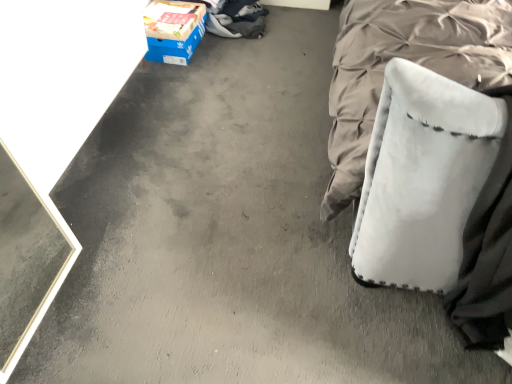
The height and width of the screenshot is (384, 512). Identify the location of white fabric swivel chair at right. (423, 178).

The image size is (512, 384). What do you see at coordinates (423, 178) in the screenshot? I see `white fabric swivel chair at right` at bounding box center [423, 178].

This screenshot has width=512, height=384. Describe the element at coordinates (173, 30) in the screenshot. I see `blue cardboard box at upper left` at that location.

Identify the location of blue cardboard box at upper left. The height and width of the screenshot is (384, 512). (173, 30).

Find the location of a particular element. white fabric swivel chair at right is located at coordinates (423, 178).

Which object is positioned more to the left, blue cardboard box at upper left or white fabric swivel chair at right?

Positioned to the left is blue cardboard box at upper left.

Which is behind, blue cardboard box at upper left or white fabric swivel chair at right?

Positioned behind is blue cardboard box at upper left.

Does point (162, 37) lie in front of point (372, 219)?

No, (162, 37) is further to viewer.

From the image's perspective, relative to white fabric swivel chair at right, is blue cardboard box at upper left above or below?

Based on their image positions, blue cardboard box at upper left is located above white fabric swivel chair at right.

From a real-world perspective, which object stands above the other?

From a 3D spatial view, white fabric swivel chair at right is above.

Considering the relative sizes of blue cardboard box at upper left and white fabric swivel chair at right in the image provided, is blue cardboard box at upper left wider than white fabric swivel chair at right?

No, blue cardboard box at upper left is not wider than white fabric swivel chair at right.

Is blue cardboard box at upper left shorter than white fabric swivel chair at right?

Correct, blue cardboard box at upper left is not as tall as white fabric swivel chair at right.

Can you confirm if blue cardboard box at upper left is bigger than white fabric swivel chair at right?

No.

Could white fabric swivel chair at right be considered to be inside blue cardboard box at upper left?

No, white fabric swivel chair at right is located outside of blue cardboard box at upper left.

Are blue cardboard box at upper left and white fabric swivel chair at right making contact?

No.

Could you tell me if blue cardboard box at upper left is turned towards white fabric swivel chair at right?

No.

What's the angular difference between blue cardboard box at upper left and white fabric swivel chair at right's facing directions?

The facing directions of blue cardboard box at upper left and white fabric swivel chair at right are 89.9 degrees apart.

Measure the distance from blue cardboard box at upper left to white fabric swivel chair at right.

The distance of blue cardboard box at upper left from white fabric swivel chair at right is 4.45 feet.

What are the coordinates of `box located underneath the white fabric swivel chair at right (from a real-world perspective)` in the screenshot? It's located at click(x=173, y=30).

Does white fabric swivel chair at right appear on the right side of blue cardboard box at upper left?

Correct, you'll find white fabric swivel chair at right to the right of blue cardboard box at upper left.

In the image, is white fabric swivel chair at right positioned in front of or behind blue cardboard box at upper left?

Visually, white fabric swivel chair at right is located in front of blue cardboard box at upper left.

Considering the points (449, 208) and (148, 36), which point is behind, point (449, 208) or point (148, 36)?

The point (148, 36) is more distant.

From the image's perspective, is white fabric swivel chair at right above or below blue cardboard box at upper left?

From the image's perspective, white fabric swivel chair at right appears below blue cardboard box at upper left.

From a real-world perspective, which is physically above, white fabric swivel chair at right or blue cardboard box at upper left?

white fabric swivel chair at right.

Is white fabric swivel chair at right wider or thinner than blue cardboard box at upper left?

Considering their sizes, white fabric swivel chair at right looks broader than blue cardboard box at upper left.

Who is shorter, white fabric swivel chair at right or blue cardboard box at upper left?

With less height is blue cardboard box at upper left.

Considering the sizes of objects white fabric swivel chair at right and blue cardboard box at upper left in the image provided, who is bigger, white fabric swivel chair at right or blue cardboard box at upper left?

With larger size is white fabric swivel chair at right.

Which is correct: white fabric swivel chair at right is inside blue cardboard box at upper left, or outside of it?

white fabric swivel chair at right is not enclosed by blue cardboard box at upper left.

Does white fabric swivel chair at right touch blue cardboard box at upper left?

No.

Is white fabric swivel chair at right turned away from blue cardboard box at upper left?

That's not correct — white fabric swivel chair at right is not looking away from blue cardboard box at upper left.

What's the angular difference between white fabric swivel chair at right and blue cardboard box at upper left's facing directions?

white fabric swivel chair at right and blue cardboard box at upper left are facing 89.9 degrees away from each other.

At what (x,y) coordinates should I click in order to perform the action: click on swivel chair to the right of blue cardboard box at upper left. Please return your answer as a coordinate pair (x, y). Looking at the image, I should click on (423, 178).

Locate an element on the screen. box that is behind the white fabric swivel chair at right is located at coordinates (173, 30).

Where is `swivel chair on the right of blue cardboard box at upper left`? The height and width of the screenshot is (384, 512). swivel chair on the right of blue cardboard box at upper left is located at coordinates (423, 178).